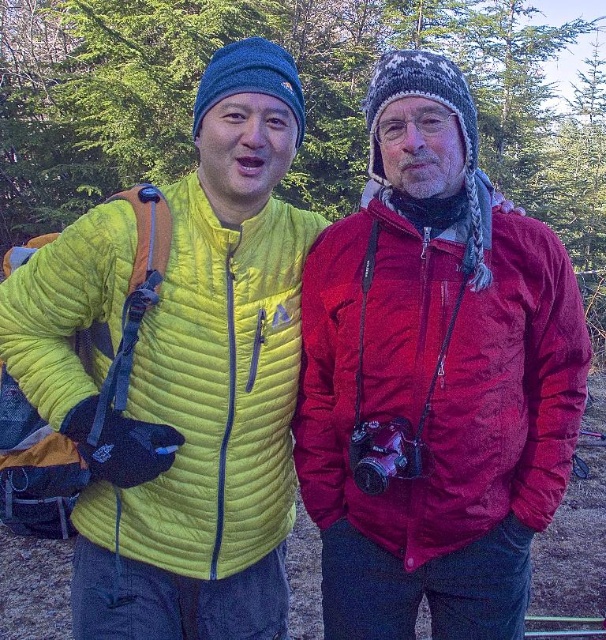
Question: Is velvet red jacket at center to the left of matte yellow jacket at left from the viewer's perspective?

Choices:
 (A) no
 (B) yes

Answer: (A)

Question: Which of the following is the farthest from the observer?

Choices:
 (A) matte yellow jacket at left
 (B) velvet red jacket at center

Answer: (A)

Question: Does velvet red jacket at center appear on the left side of matte yellow jacket at left?

Choices:
 (A) no
 (B) yes

Answer: (A)

Question: Among these points, which one is farthest from the camera?

Choices:
 (A) pos(421,474)
 (B) pos(276,371)

Answer: (B)

Question: Which of the following is the farthest from the observer?

Choices:
 (A) [x=387, y=275]
 (B) [x=47, y=264]

Answer: (A)

Question: Is velvet red jacket at center positioned behind matte yellow jacket at left?

Choices:
 (A) no
 (B) yes

Answer: (A)